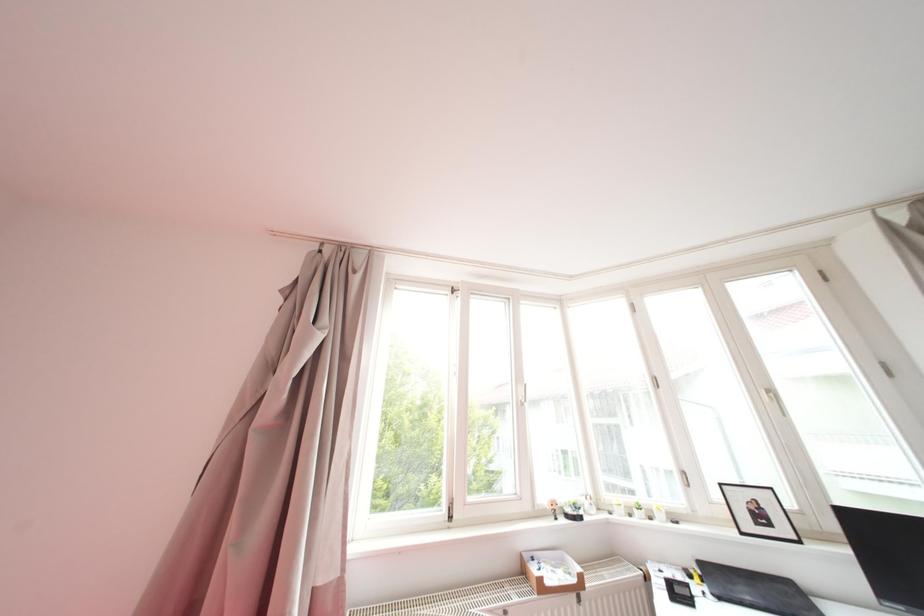
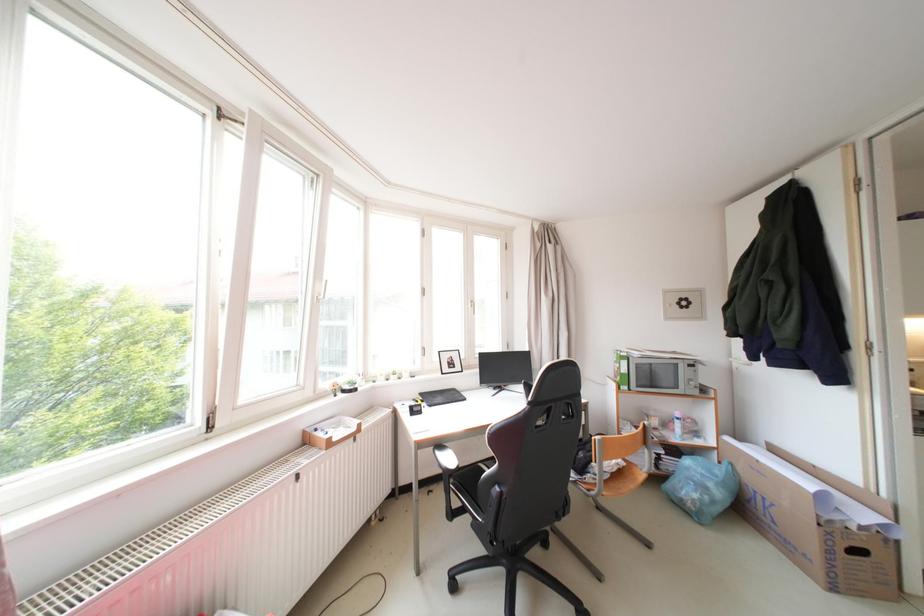
Question: The camera is either moving clockwise (left) or counter-clockwise (right) around the object. The first image is from the beginning of the video and the second image is from the end. Is the camera moving left or right when shooting the video?

Choices:
 (A) Left
 (B) Right

Answer: (A)